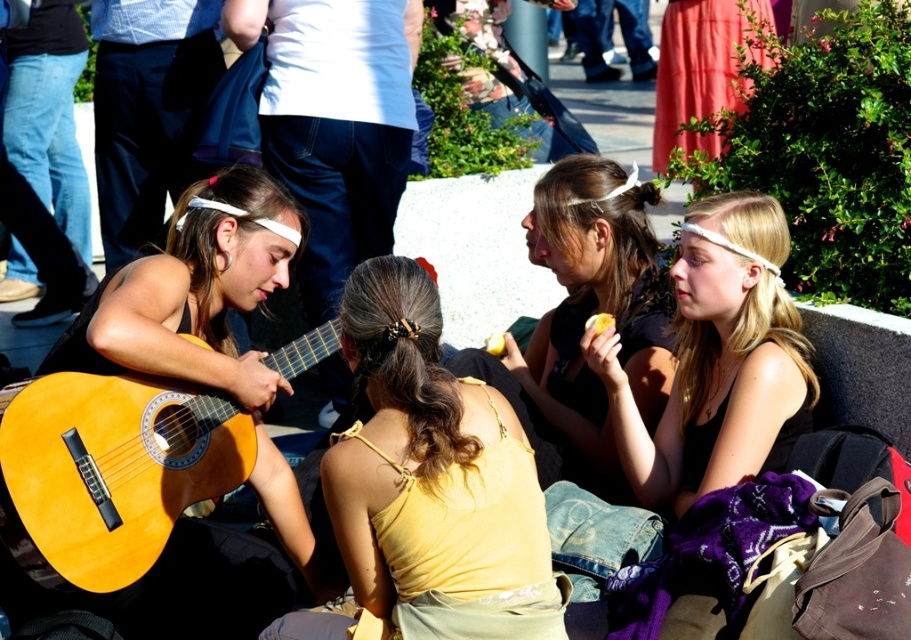
Which of the two tops, the yellow fabric top at center or the matte black tank top at upper right, has a larger width?

The yellow fabric top at center is wider than the matte black tank top at upper right according to the description.